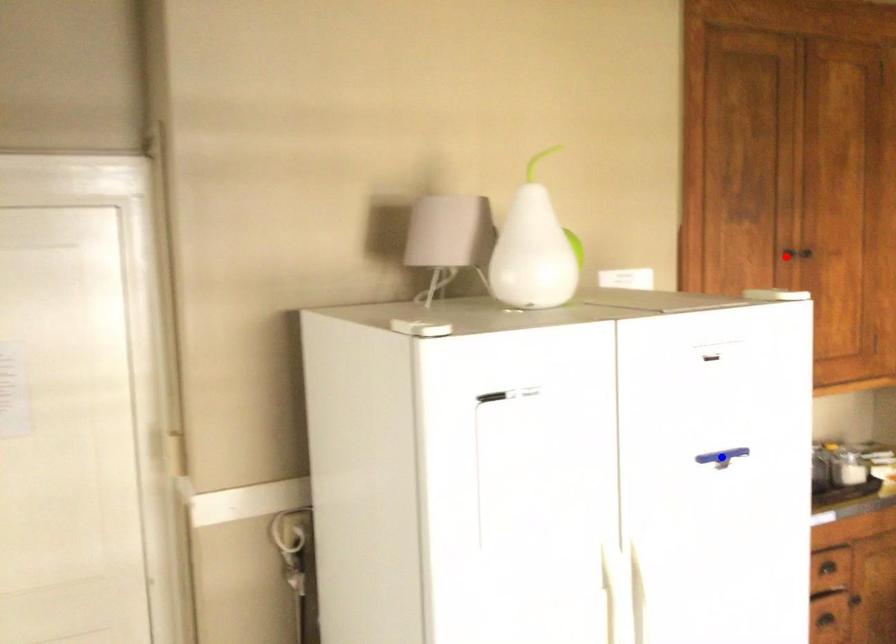
Question: Which of the two points in the image is closer to the camera?

Choices:
 (A) Blue point is closer.
 (B) Red point is closer.

Answer: (A)